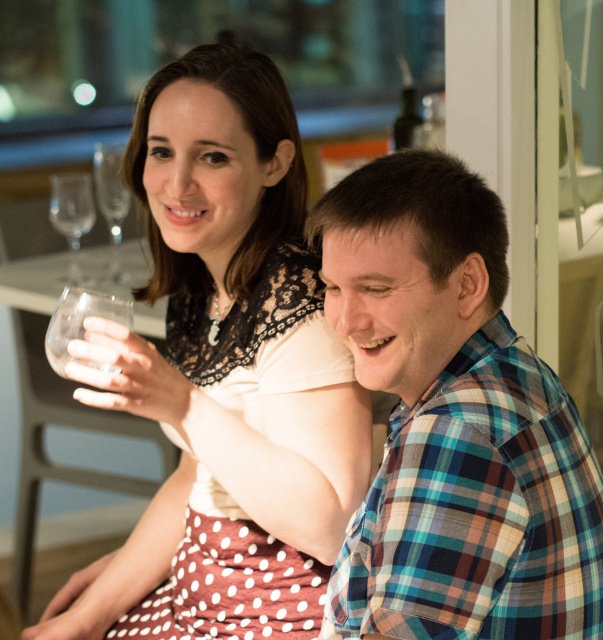
Question: Is white lace dress at upper center behind clear glass wine glass at upper left?

Choices:
 (A) yes
 (B) no

Answer: (B)

Question: Can you confirm if plaid cotton shirt at right is positioned to the left of clear glass wine glass at upper left?

Choices:
 (A) no
 (B) yes

Answer: (A)

Question: Can you confirm if white lace dress at upper center is positioned above transparent glass at left?

Choices:
 (A) no
 (B) yes

Answer: (A)

Question: Which object appears closest to the camera in this image?

Choices:
 (A) white lace dress at upper center
 (B) plaid cotton shirt at right
 (C) transparent glass at left
 (D) clear glass wine glass at upper left

Answer: (B)

Question: Considering the real-world distances, which object is closest to the white lace dress at upper center?

Choices:
 (A) transparent glass at left
 (B) clear glass wine glass at upper left
 (C) plaid cotton shirt at right

Answer: (C)

Question: Estimate the real-world distances between objects in this image. Which object is farther from the transparent glass at left?

Choices:
 (A) plaid cotton shirt at right
 (B) white lace dress at upper center
 (C) clear glass wine glass at upper left

Answer: (A)